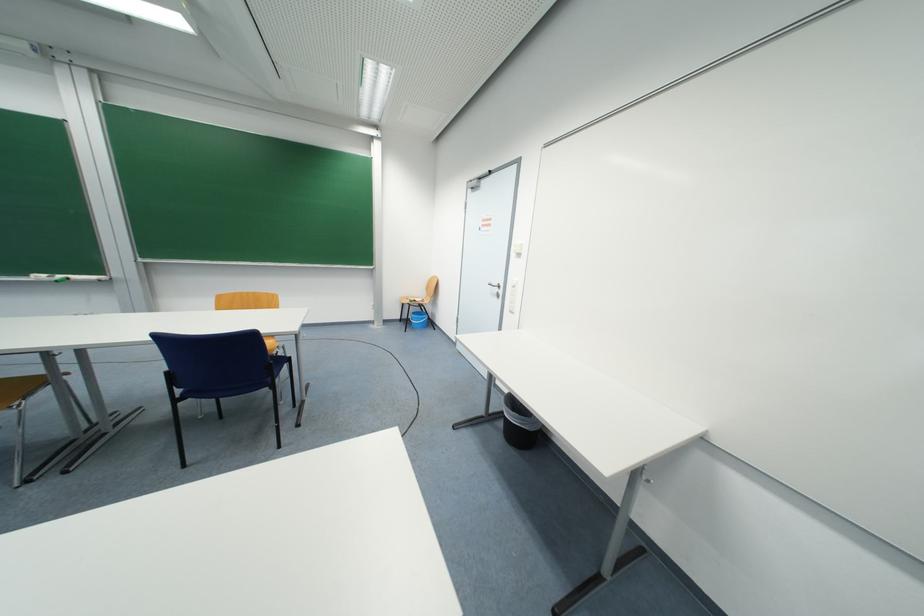
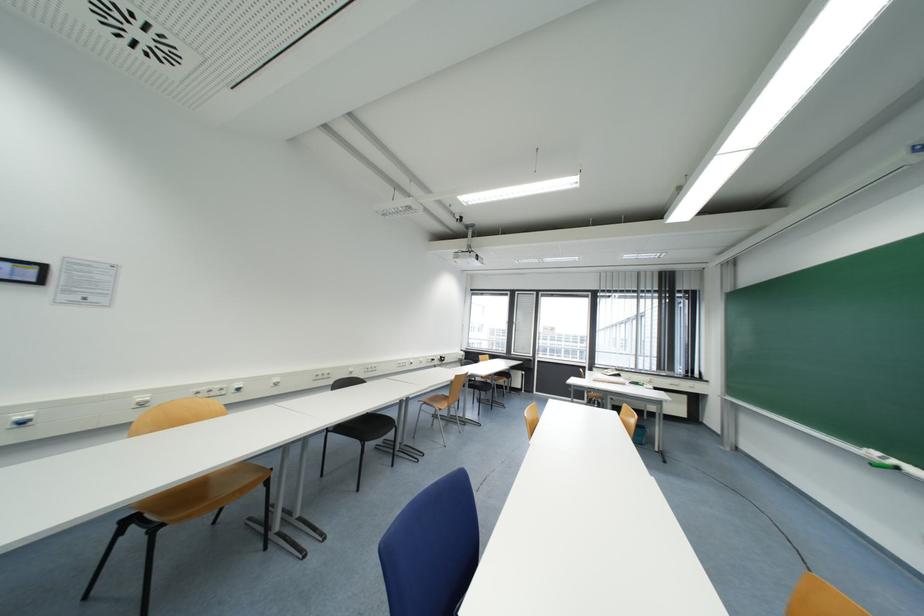
In the second image, find the point that corresponds to pixel 31 47 in the first image.

(909, 154)